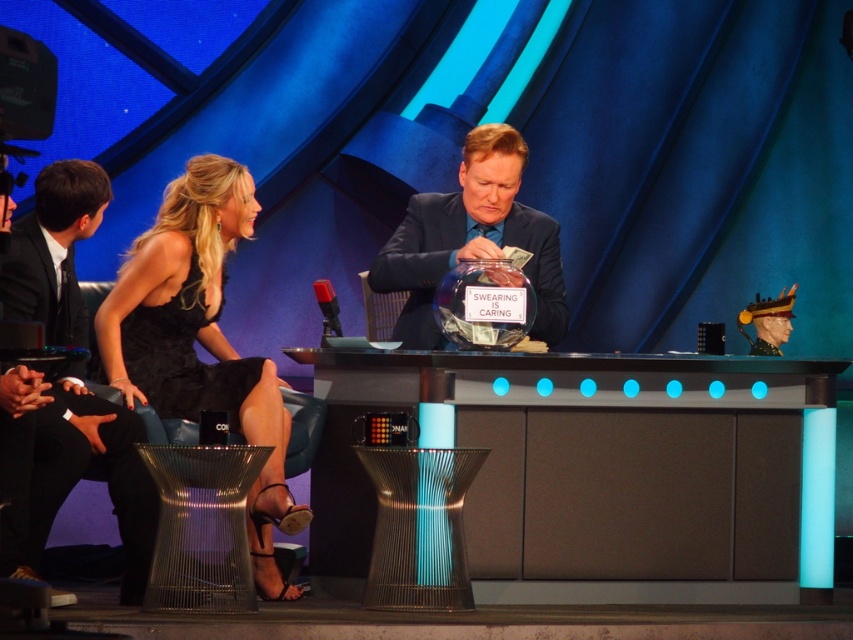
Is black satin dress at center to the right of black satin dress at left from the viewer's perspective?

Indeed, black satin dress at center is positioned on the right side of black satin dress at left.

Between black satin dress at center and black satin dress at left, which one appears on the left side from the viewer's perspective?

From the viewer's perspective, black satin dress at left appears more on the left side.

Which is behind, point (138, 353) or point (85, 417)?

The point (138, 353) is behind.

Image resolution: width=853 pixels, height=640 pixels. Find the location of `black satin dress at center`. black satin dress at center is located at coordinates (201, 340).

Which is above, black satin dress at left or shiny black suit at center?

shiny black suit at center is above.

Between black satin dress at left and shiny black suit at center, which one appears on the left side from the viewer's perspective?

black satin dress at left is more to the left.

Does point (45, 506) come closer to viewer compared to point (465, 232)?

That is True.

You are a GUI agent. You are given a task and a screenshot of the screen. Output one action in this format:
    pyautogui.click(x=<x>, y=<y>)
    Task: Click on the black satin dress at left
    This screenshot has width=853, height=640.
    Given the screenshot: What is the action you would take?
    pyautogui.click(x=73, y=472)

Measure the distance between black satin dress at center and camera.

black satin dress at center and camera are 4.43 meters apart from each other.

This screenshot has height=640, width=853. Describe the element at coordinates (201, 340) in the screenshot. I see `black satin dress at center` at that location.

The width and height of the screenshot is (853, 640). I want to click on black satin dress at center, so click(201, 340).